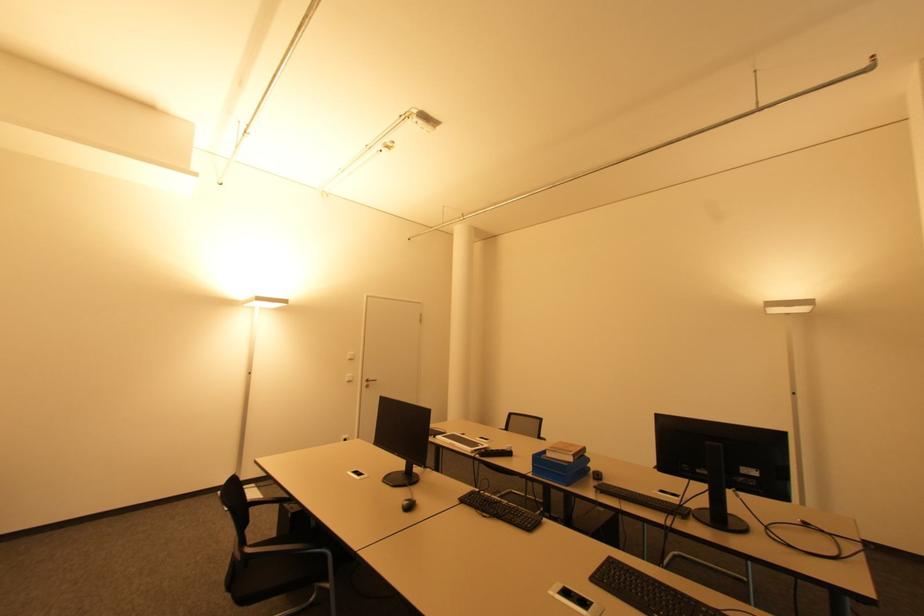
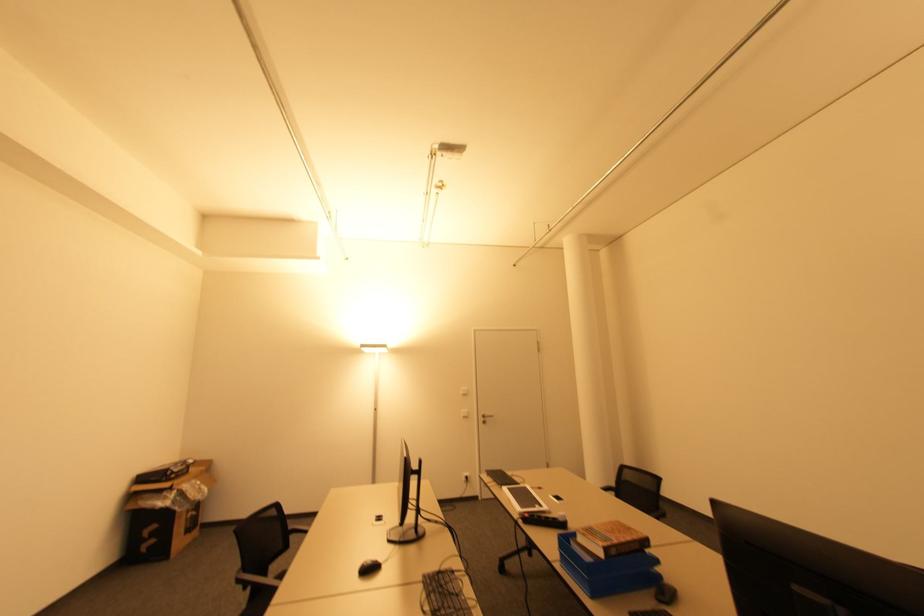
Find the pixel in the second image that matches point 369,387 in the first image.

(485, 422)